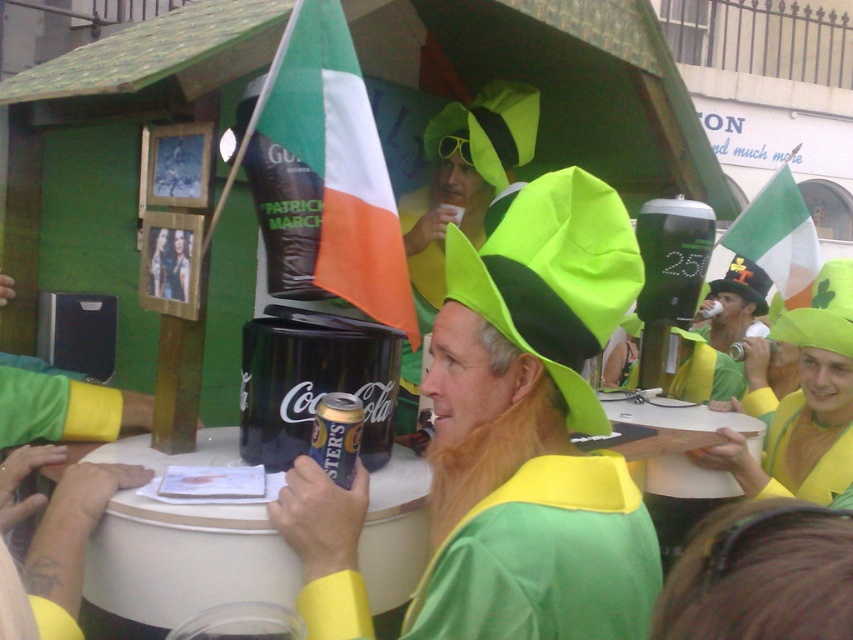
Does shiny gold hat at center have a lesser height compared to shiny black hat at center?

No.

Does shiny gold hat at center appear on the right side of shiny black hat at center?

No, shiny gold hat at center is not to the right of shiny black hat at center.

Locate an element on the screen. The image size is (853, 640). shiny gold hat at center is located at coordinates (735, 301).

Can you confirm if white plastic table at center is positioned to the left of green fabric flag at upper right?

Yes, white plastic table at center is to the left of green fabric flag at upper right.

Is white plastic table at center closer to the viewer compared to green fabric flag at upper right?

Yes, white plastic table at center is closer to the viewer.

The height and width of the screenshot is (640, 853). I want to click on white plastic table at center, so click(183, 563).

Identify the location of white plastic table at center. (183, 563).

Does green fabric flag at upper center have a larger size compared to green fabric flag at upper right?

Actually, green fabric flag at upper center might be smaller than green fabric flag at upper right.

What do you see at coordinates (338, 161) in the screenshot? I see `green fabric flag at upper center` at bounding box center [338, 161].

You are a GUI agent. You are given a task and a screenshot of the screen. Output one action in this format:
    pyautogui.click(x=<x>, y=<y>)
    Task: Click on the green fabric flag at upper center
    The height and width of the screenshot is (640, 853).
    Given the screenshot: What is the action you would take?
    pyautogui.click(x=338, y=161)